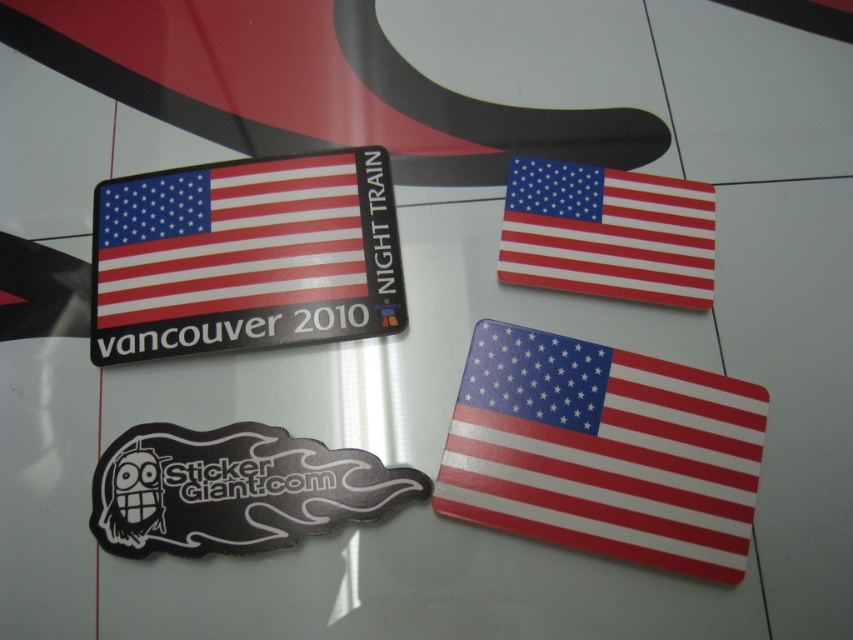
You are a customer at a car wash and see the black rubber sticker at lower left and the shiny plastic flag at upper right on the car hood. Which sticker is closer to you?

The black rubber sticker at lower left is closer to you because it is in front of the shiny plastic flag at upper right.

You are designing a layout for a car hood and want to place both the shiny metallic sticker at upper left and the shiny plastic flag at upper right. Considering their sizes, which sticker should be placed first to ensure proper visibility?

The shiny metallic sticker at upper left should be placed first because it is larger than the shiny plastic flag at upper right, ensuring it doesn

From the picture: You are standing in front of the reflective surface with two points marked. Can you determine which point is closer to you? The points are labeled as point (225, 316) and point (105, 522).

Point (105, 522) is closer to you because it is in front of point (225, 316) according to their positions.